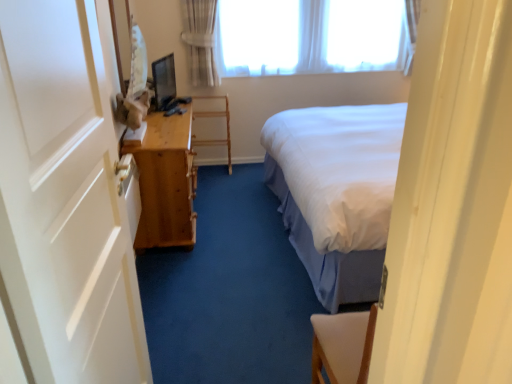
Question: Is light brown wooden table at left facing towards wooden shelf at center?

Choices:
 (A) no
 (B) yes

Answer: (A)

Question: Does light brown wooden table at left have a greater width compared to wooden shelf at center?

Choices:
 (A) no
 (B) yes

Answer: (B)

Question: Is light brown wooden table at left in front of wooden shelf at center?

Choices:
 (A) yes
 (B) no

Answer: (A)

Question: Is the depth of light brown wooden table at left greater than that of wooden shelf at center?

Choices:
 (A) yes
 (B) no

Answer: (B)

Question: From the image's perspective, does light brown wooden table at left appear lower than wooden shelf at center?

Choices:
 (A) no
 (B) yes

Answer: (B)

Question: From the image's perspective, would you say light brown wooden table at left is positioned over wooden shelf at center?

Choices:
 (A) yes
 (B) no

Answer: (B)

Question: Is light brown wooden table at left at the right side of white painted wood door at left?

Choices:
 (A) no
 (B) yes

Answer: (A)

Question: From the image's perspective, is light brown wooden table at left over white painted wood door at left?

Choices:
 (A) no
 (B) yes

Answer: (B)

Question: Is light brown wooden table at left thinner than white painted wood door at left?

Choices:
 (A) no
 (B) yes

Answer: (A)

Question: Is light brown wooden table at left aimed at white painted wood door at left?

Choices:
 (A) no
 (B) yes

Answer: (A)

Question: Does light brown wooden table at left have a greater width compared to white painted wood door at left?

Choices:
 (A) no
 (B) yes

Answer: (B)

Question: Considering the relative sizes of light brown wooden table at left and white painted wood door at left in the image provided, is light brown wooden table at left shorter than white painted wood door at left?

Choices:
 (A) yes
 (B) no

Answer: (A)

Question: Is white sheer curtain at upper center further to camera compared to white painted wood door at left?

Choices:
 (A) yes
 (B) no

Answer: (A)